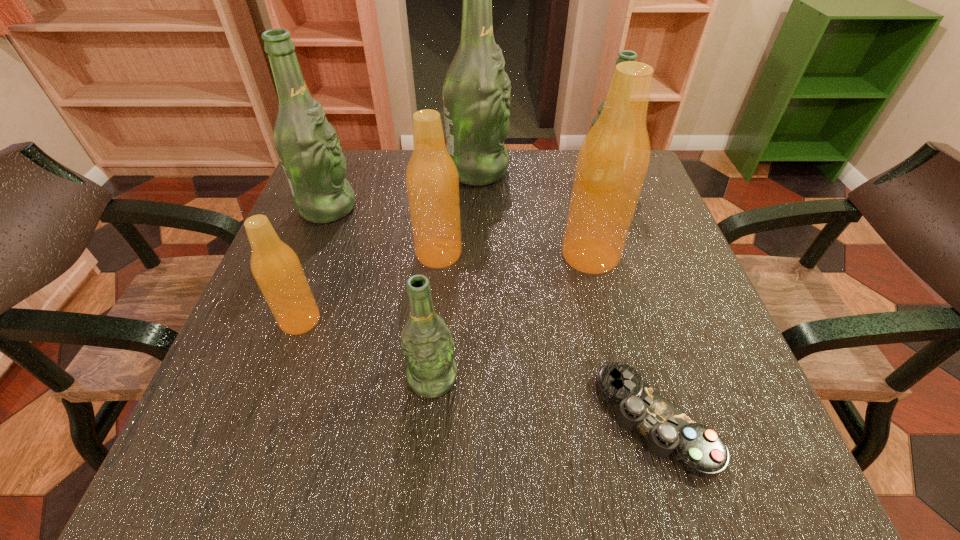
Locate an element on the screen. This screenshot has height=540, width=960. control is located at coordinates (700, 450).

The image size is (960, 540). I want to click on blank area located on the surface of the tallest beer bottle, so click(x=536, y=171).

The height and width of the screenshot is (540, 960). Identify the location of blank area located on the surface of the leftmost green beer bottle. (530, 208).

The width and height of the screenshot is (960, 540). I want to click on free location located on the front of the biggest tan beer bottle, so click(605, 312).

The height and width of the screenshot is (540, 960). What are the coordinates of `vacant space located on the surface of the rightmost green beer bottle` in the screenshot? It's located at (547, 180).

Identify the location of vacant region located on the surface of the rightmost green beer bottle. (494, 180).

Locate an element on the screen. blank space located on the surface of the rightmost green beer bottle is located at coordinates (438, 180).

Identify the location of blank area located on the front of the second tan beer bottle from left to right. (431, 330).

This screenshot has width=960, height=540. I want to click on vacant space located on the front of the leftmost tan beer bottle, so click(276, 388).

The image size is (960, 540). I want to click on blank area located 0.060m on the surface of the nearest beer bottle, so [427, 438].